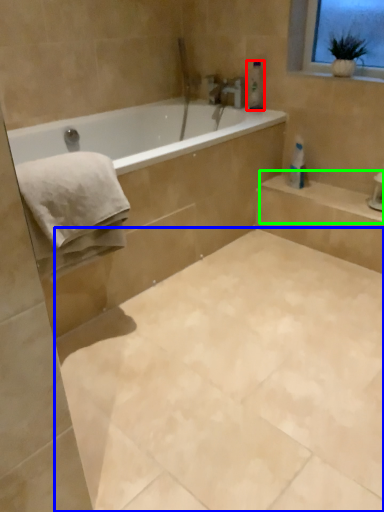
Question: Which is farther away from toiletry (highlighted by a red box)? ceramic tile (highlighted by a blue box) or balustrade (highlighted by a green box)?

Choices:
 (A) ceramic tile
 (B) balustrade

Answer: (A)